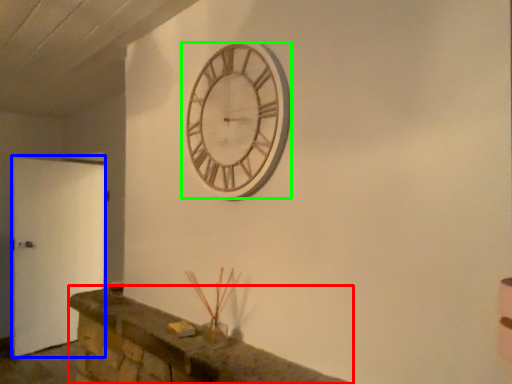
Question: Considering the real-world distances, which object is farthest from mantle (highlighted by a red box)? door (highlighted by a blue box) or wall clock (highlighted by a green box)?

Choices:
 (A) door
 (B) wall clock

Answer: (A)